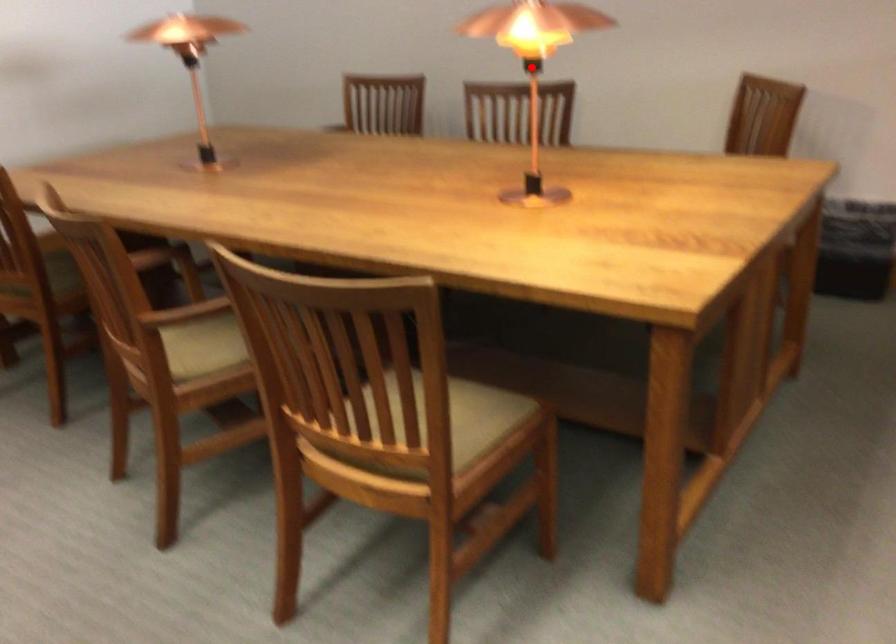
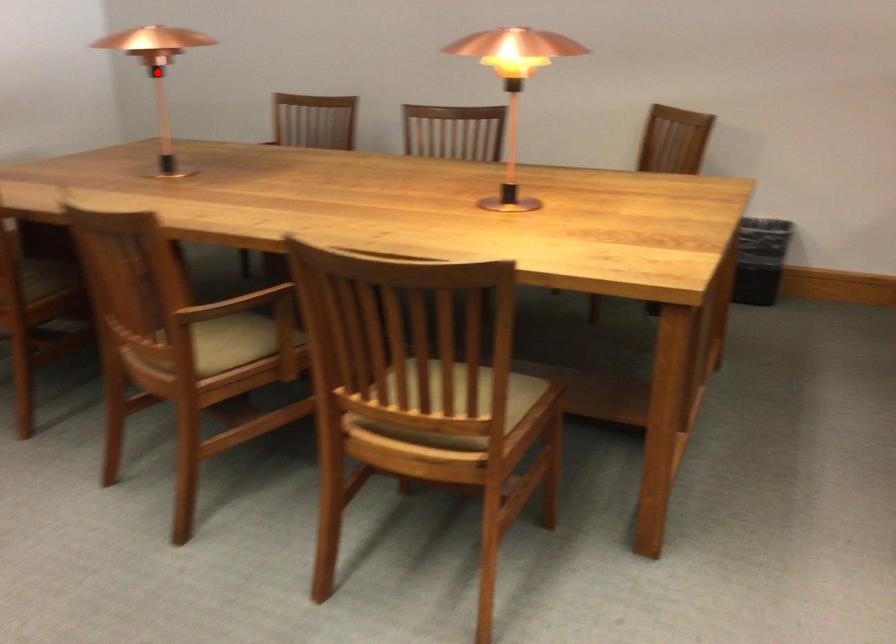
I am providing you with two images of the same scene from different viewpoints. A red point is marked on the first image and another point is marked on the second image. Does the point marked in image1 correspond to the same location as the one in image2?

No